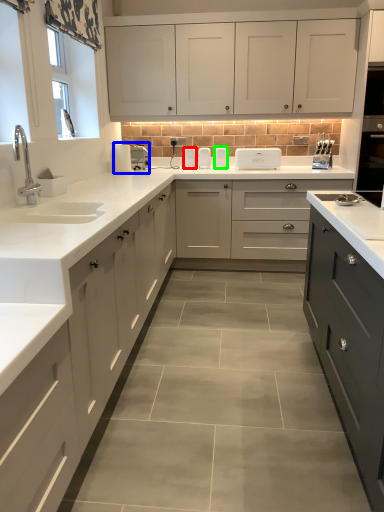
Question: Based on their relative distances, which object is nearer to appliance (highlighted by a red box)? Choose from appliance (highlighted by a blue box) and appliance (highlighted by a green box).

Choices:
 (A) appliance
 (B) appliance

Answer: (B)